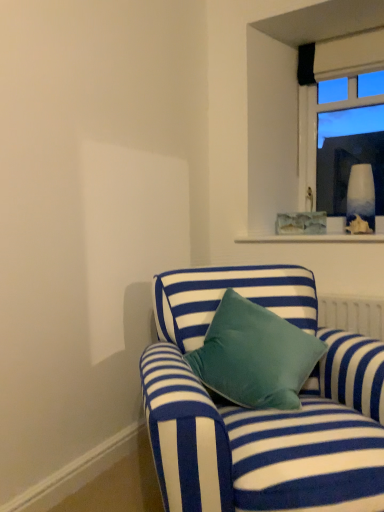
I want to click on clear glass window at upper right, so click(x=349, y=57).

Image resolution: width=384 pixels, height=512 pixels. Describe the element at coordinates (349, 57) in the screenshot. I see `clear glass window at upper right` at that location.

The height and width of the screenshot is (512, 384). What do you see at coordinates (261, 412) in the screenshot?
I see `blue striped fabric couch at lower center` at bounding box center [261, 412].

Locate an element on the screen. This screenshot has height=512, width=384. blue striped fabric couch at lower center is located at coordinates (261, 412).

Identify the location of clear glass window at upper right. The width and height of the screenshot is (384, 512). (349, 57).

Based on the photo, between clear glass window at upper right and blue striped fabric couch at lower center, which one appears on the left side from the viewer's perspective?

blue striped fabric couch at lower center is more to the left.

Between clear glass window at upper right and blue striped fabric couch at lower center, which one is positioned behind?

clear glass window at upper right is further from the camera.

Which point is more forward, [317,66] or [167,418]?

Positioned in front is point [167,418].

From the image's perspective, which one is positioned lower, clear glass window at upper right or blue striped fabric couch at lower center?

blue striped fabric couch at lower center is shown below in the image.

From a real-world perspective, between clear glass window at upper right and blue striped fabric couch at lower center, who is vertically higher?

clear glass window at upper right, from a real-world perspective.

Is clear glass window at upper right wider or thinner than blue striped fabric couch at lower center?

Clearly, clear glass window at upper right has less width compared to blue striped fabric couch at lower center.

In the scene shown: Considering the sizes of objects clear glass window at upper right and blue striped fabric couch at lower center in the image provided, who is shorter, clear glass window at upper right or blue striped fabric couch at lower center?

Standing shorter between the two is blue striped fabric couch at lower center.

Considering the relative sizes of clear glass window at upper right and blue striped fabric couch at lower center in the image provided, is clear glass window at upper right bigger than blue striped fabric couch at lower center?

No, clear glass window at upper right is not bigger than blue striped fabric couch at lower center.

Does clear glass window at upper right contain blue striped fabric couch at lower center?

No, blue striped fabric couch at lower center is not inside clear glass window at upper right.

Is clear glass window at upper right in contact with blue striped fabric couch at lower center?

No.

Looking at this image, is clear glass window at upper right facing towards blue striped fabric couch at lower center?

Yes, clear glass window at upper right is facing blue striped fabric couch at lower center.

How different are the orientations of clear glass window at upper right and blue striped fabric couch at lower center in degrees?

They differ by 43 degrees in their facing directions.

Where is `studio couch beneath the clear glass window at upper right (from a real-world perspective)`? The height and width of the screenshot is (512, 384). studio couch beneath the clear glass window at upper right (from a real-world perspective) is located at coordinates [x=261, y=412].

In the scene shown: Which is more to the left, blue striped fabric couch at lower center or clear glass window at upper right?

From the viewer's perspective, blue striped fabric couch at lower center appears more on the left side.

Is the position of blue striped fabric couch at lower center more distant than that of clear glass window at upper right?

No, it is not.

Does point (175, 460) lie in front of point (380, 37)?

Yes.

In the scene shown: From the image's perspective, is blue striped fabric couch at lower center under clear glass window at upper right?

Indeed, from the image's perspective, blue striped fabric couch at lower center is shown beneath clear glass window at upper right.

From a real-world perspective, which is physically above, blue striped fabric couch at lower center or clear glass window at upper right?

clear glass window at upper right is physically above.

In the scene shown: Considering the sizes of objects blue striped fabric couch at lower center and clear glass window at upper right in the image provided, who is thinner, blue striped fabric couch at lower center or clear glass window at upper right?

With smaller width is clear glass window at upper right.

From their relative heights in the image, would you say blue striped fabric couch at lower center is taller or shorter than clear glass window at upper right?

Clearly, blue striped fabric couch at lower center is shorter compared to clear glass window at upper right.

Who is bigger, blue striped fabric couch at lower center or clear glass window at upper right?

With larger size is blue striped fabric couch at lower center.

Is blue striped fabric couch at lower center surrounding clear glass window at upper right?

That's incorrect, clear glass window at upper right is not inside blue striped fabric couch at lower center.

Is blue striped fabric couch at lower center far from clear glass window at upper right?

blue striped fabric couch at lower center is positioned a significant distance from clear glass window at upper right.

In the scene shown: Is blue striped fabric couch at lower center aimed at clear glass window at upper right?

No, blue striped fabric couch at lower center is not aimed at clear glass window at upper right.

How many degrees apart are the facing directions of blue striped fabric couch at lower center and clear glass window at upper right?

The facing directions of blue striped fabric couch at lower center and clear glass window at upper right are 43 degrees apart.

In the image, there is a blue striped fabric couch at lower center. Identify the location of window above it (from the image's perspective). This screenshot has width=384, height=512. click(349, 57).

Locate an element on the screen. The height and width of the screenshot is (512, 384). studio couch below the clear glass window at upper right (from a real-world perspective) is located at coordinates (261, 412).

The height and width of the screenshot is (512, 384). I want to click on window above the blue striped fabric couch at lower center (from the image's perspective), so click(x=349, y=57).